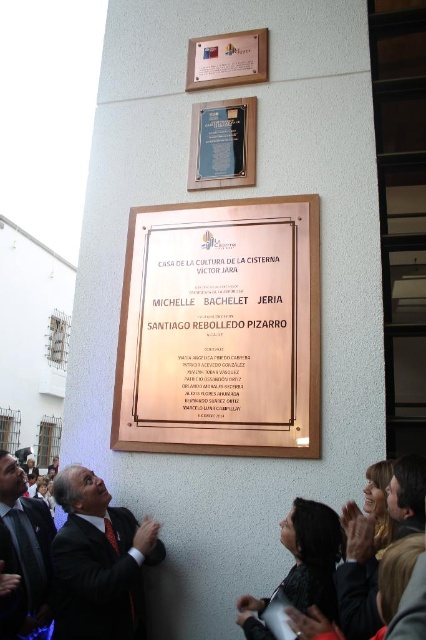
You are attending a formal event and notice two items of interest. You see a dark suit at lower left and a gold metallic plaque at upper center. Which of these two items is larger in size?

The gold metallic plaque at upper center is larger than the dark suit at lower left.

You are standing at the point with coordinates (19, 522). Looking towards the plaque, is the point with coordinates (189, 435) located in front of or behind you?

The point with coordinates (189, 435) is behind point with coordinates (19, 522), so it is behind you.